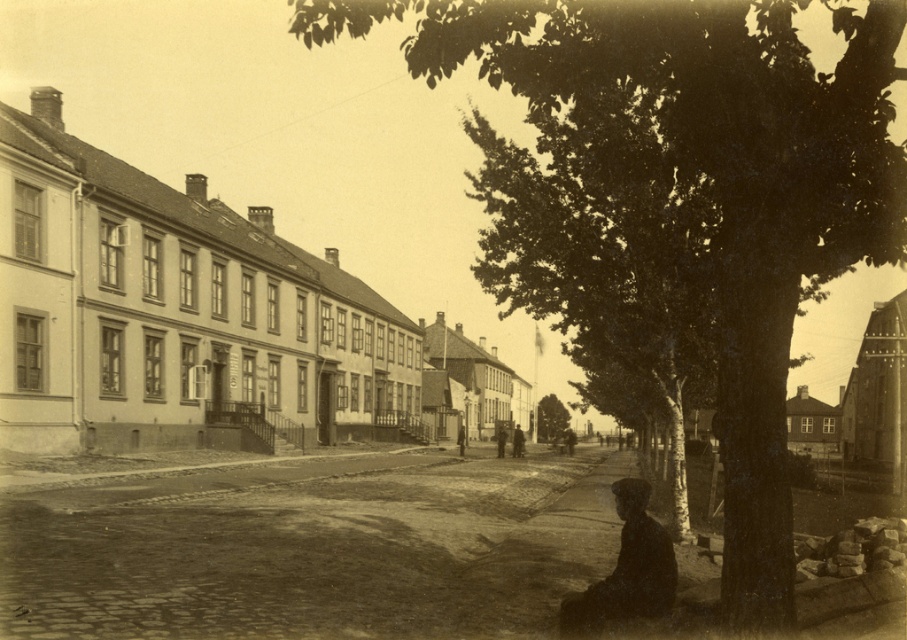
Question: Which of the following is the farthest from the observer?

Choices:
 (A) smooth bark tree at center
 (B) green leafy tree at center
 (C) dark green textured tree at center

Answer: (C)

Question: Where is smooth bark tree at center located in relation to dark green textured tree at center in the image?

Choices:
 (A) below
 (B) above

Answer: (B)

Question: Which object is positioned farthest from the green leafy tree at center?

Choices:
 (A) smooth bark tree at center
 (B) dark green textured tree at center

Answer: (B)

Question: Which object is the closest to the green leafy tree at center?

Choices:
 (A) smooth bark tree at center
 (B) dark green textured tree at center

Answer: (A)

Question: Observing the image, what is the correct spatial positioning of smooth bark tree at center in reference to dark green textured tree at center?

Choices:
 (A) below
 (B) above

Answer: (B)

Question: Is green leafy tree at center smaller than dark green textured tree at center?

Choices:
 (A) yes
 (B) no

Answer: (B)